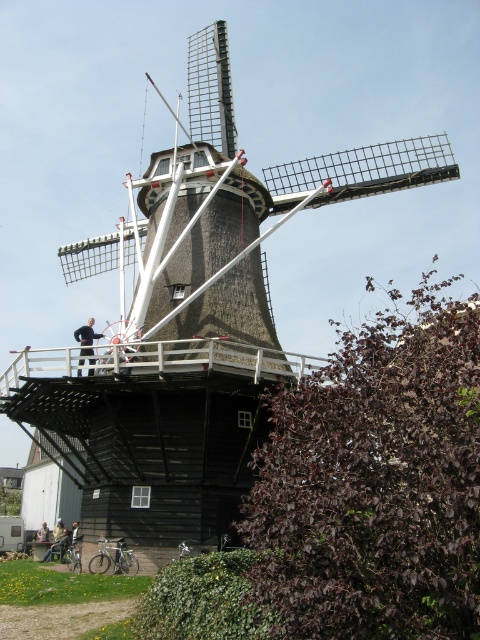
You are a photographer planning to take a photo of the windmill. You notice two people wearing jackets on the platform. The first person is wearing a black fabric jacket at upper left, and the second is wearing a dark brown leather jacket at center. Which jacket has a larger width?

The black fabric jacket at upper left has a larger width than the dark brown leather jacket at center according to the description.

You are a visitor standing on the platform of the Dutch windmill and want to take a photo of the black fabric jacket at upper left and dark blue jeans at lower left. Which object will appear larger in your photo?

The black fabric jacket at upper left will appear larger in the photo because it is closer to the viewer than the dark blue jeans at lower left.